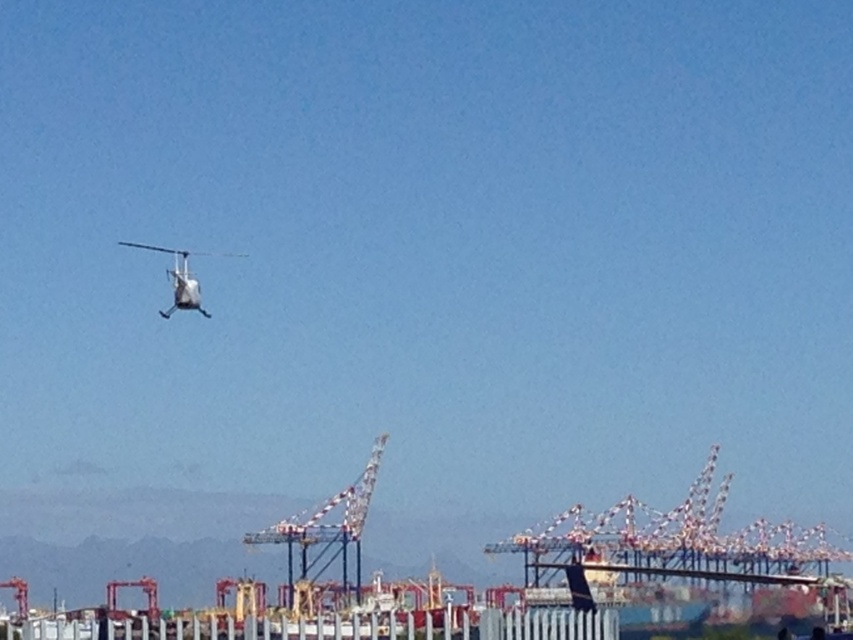
You are a photographer trying to capture the white painted metal crane at center and the white matte helicopter at upper left in the same frame. Based on their sizes in the image, which object would appear smaller?

The white painted metal crane at center appears smaller in the image because its width is less than that of the white matte helicopter at upper left.

You are a drone operator trying to navigate your drone between the white painted metal crane at center and the white matte helicopter at upper left. Since both are white, you need to determine their heights to avoid collision. According to the scene description, which object is taller?

The white painted metal crane at center is taller than the white matte helicopter at upper left, so you should adjust your flight path to account for the crane being higher.

You are a pilot flying the white matte helicopter at upper left and need to land in an open area near the white painted metal crane at center. Based on the scene, can you safely descend directly toward the crane without obstacles?

The white painted metal crane at center is located below the white matte helicopter at upper left, so yes, you can safely descend directly toward the crane as there are no obstacles blocking the path between them.